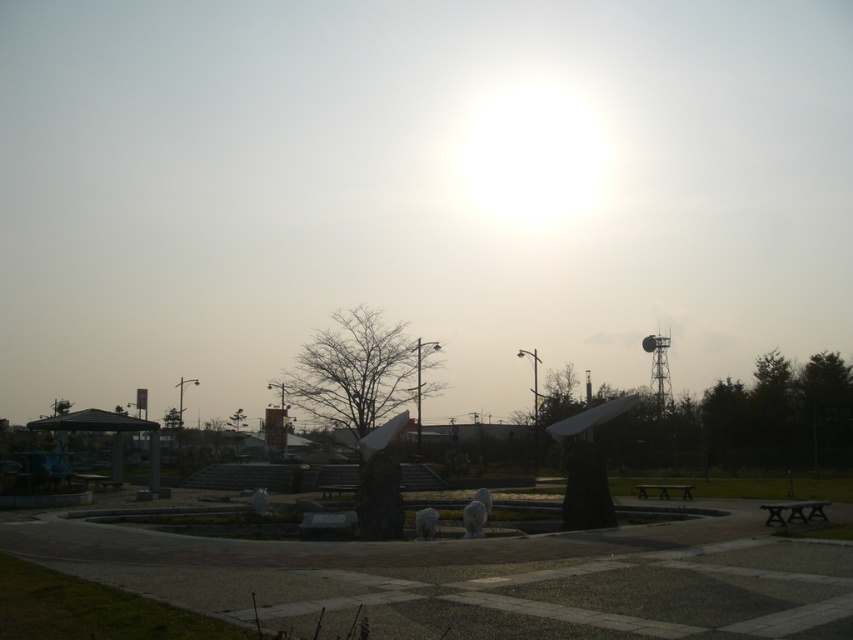
This screenshot has height=640, width=853. What do you see at coordinates (743, 420) in the screenshot?
I see `dark brown wooden tree at center` at bounding box center [743, 420].

Is point (833, 388) less distant than point (811, 509)?

No, it is not.

You are a GUI agent. You are given a task and a screenshot of the screen. Output one action in this format:
    pyautogui.click(x=<x>, y=<y>)
    Task: Click on the dark brown wooden tree at center
    
    Given the screenshot: What is the action you would take?
    pyautogui.click(x=743, y=420)

How much distance is there between dark brown wooden tree at center and green matte tree at lower left?

dark brown wooden tree at center and green matte tree at lower left are 67.96 meters apart from each other.

Which is more to the right, dark brown wooden tree at center or green matte tree at lower left?

dark brown wooden tree at center

Is point (704, 403) in front of point (61, 397)?

Yes, it is in front of point (61, 397).

Identify the location of dark brown wooden tree at center. (743, 420).

Which is more to the right, bare wood tree at center or dark brown wooden bench at lower right?

From the viewer's perspective, dark brown wooden bench at lower right appears more on the right side.

Is bare wood tree at center below dark brown wooden bench at lower right?

No.

Locate an element on the screen. bare wood tree at center is located at coordinates (358, 371).

This screenshot has height=640, width=853. In order to click on bare wood tree at center in this screenshot , I will do `click(358, 371)`.